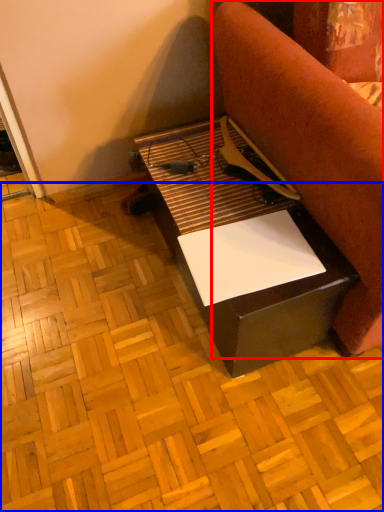
Question: Among these objects, which one is farthest to the camera, furniture (highlighted by a red box) or plywood (highlighted by a blue box)?

Choices:
 (A) furniture
 (B) plywood

Answer: (B)